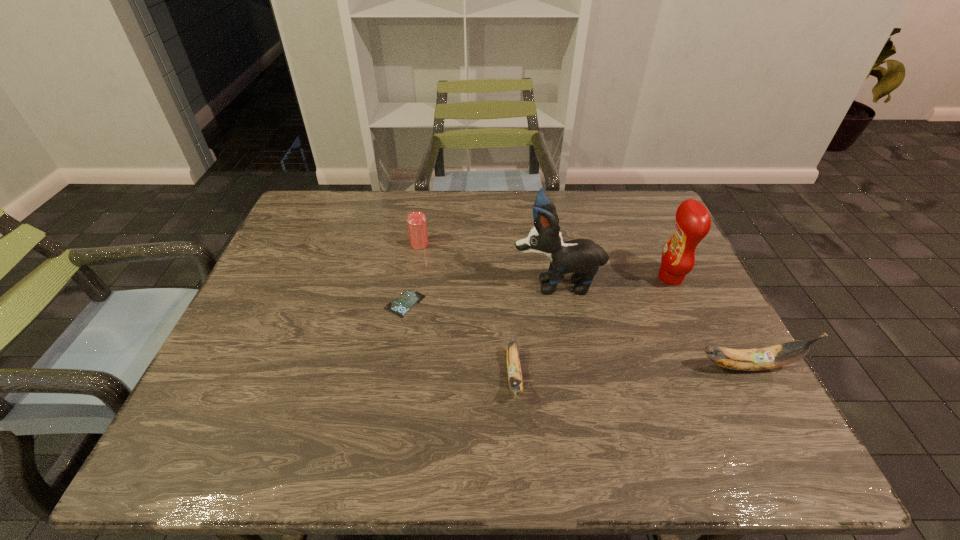
Identify the location of vacant space located on the label side of the fifth shortest object. The width and height of the screenshot is (960, 540). (564, 278).

Find the location of a particular element. The height and width of the screenshot is (540, 960). vacant region located 0.250m on the label side of the fifth shortest object is located at coordinates (564, 278).

Identify the location of vacant space situated on the label side of the fifth shortest object. The height and width of the screenshot is (540, 960). (562, 278).

This screenshot has height=540, width=960. Identify the location of vacant space located 0.330m on the front-facing side of the puppy. (389, 283).

The height and width of the screenshot is (540, 960). In order to click on vacant space located on the front-facing side of the puppy in this screenshot , I will do `click(464, 283)`.

The height and width of the screenshot is (540, 960). Find the location of `vacant space situated 0.110m on the front-facing side of the puppy`. vacant space situated 0.110m on the front-facing side of the puppy is located at coordinates (470, 283).

At what (x,y) coordinates should I click in order to perform the action: click on vacant space positioned 0.170m on the front of the shortest object. Please return your answer as a coordinate pair (x, y). The height and width of the screenshot is (540, 960). Looking at the image, I should click on (393, 376).

Find the location of a particular element. This screenshot has width=960, height=540. object that is at the near edge is located at coordinates (514, 372).

Where is `banana that is positioned at the right edge`? This screenshot has width=960, height=540. banana that is positioned at the right edge is located at coordinates (783, 354).

Where is `condiment that is at the right edge`? condiment that is at the right edge is located at coordinates (693, 222).